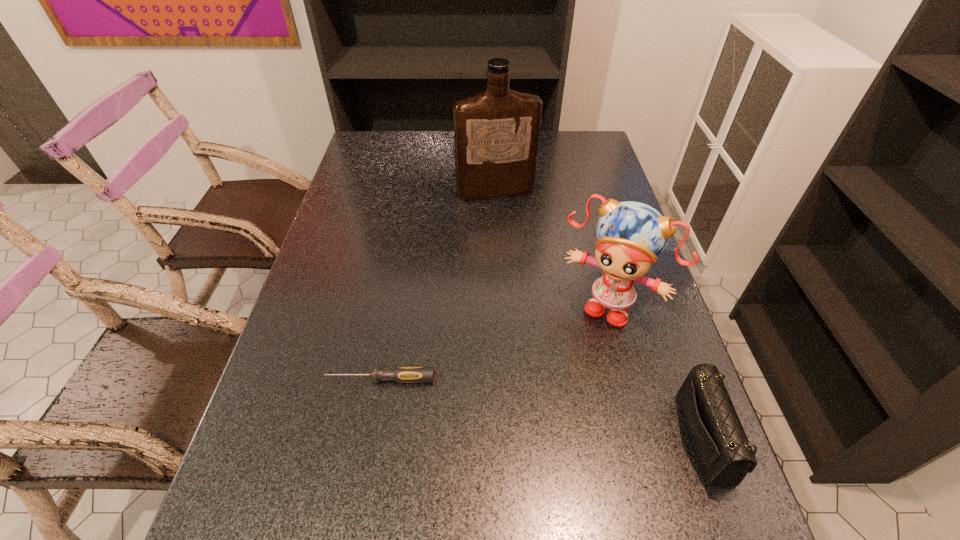
The height and width of the screenshot is (540, 960). I want to click on screwdriver, so (x=402, y=374).

Find the location of a particular element. the leftmost object is located at coordinates (402, 374).

Locate an element on the screen. clutch bag is located at coordinates (724, 453).

Find the location of `the third tallest object`. the third tallest object is located at coordinates (724, 453).

At what (x,y) coordinates should I click in order to perform the action: click on liquor. Please return your answer as a coordinate pair (x, y). Image resolution: width=960 pixels, height=540 pixels. Looking at the image, I should click on (496, 133).

The image size is (960, 540). Find the location of `the tallest object`. the tallest object is located at coordinates (496, 133).

This screenshot has height=540, width=960. What are the coordinates of `the second farthest object` in the screenshot? It's located at (631, 235).

At what (x,y) coordinates should I click in order to perform the action: click on the third shortest object. Please return your answer as a coordinate pair (x, y). The height and width of the screenshot is (540, 960). Looking at the image, I should click on (631, 235).

Where is `vacant point located insert the second nearest object into a screw head`? This screenshot has width=960, height=540. vacant point located insert the second nearest object into a screw head is located at coordinates (271, 379).

This screenshot has width=960, height=540. Find the location of `free spot located 0.220m on the label side of the tallest object`. free spot located 0.220m on the label side of the tallest object is located at coordinates (519, 246).